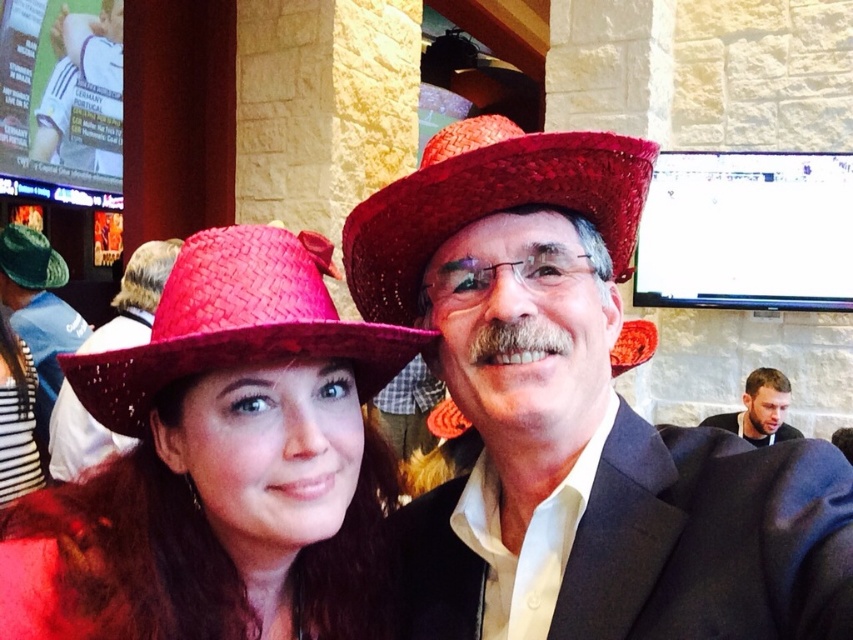
From the picture: Can you confirm if bright red woven cowboy hat at center is smaller than green felt hat at upper left?

Yes, bright red woven cowboy hat at center is smaller than green felt hat at upper left.

Does bright red woven cowboy hat at center appear over green felt hat at upper left?

Incorrect, bright red woven cowboy hat at center is not positioned above green felt hat at upper left.

Does point (373, 394) come behind point (10, 236)?

No, (373, 394) is closer to viewer.

Where is `bright red woven cowboy hat at center`? bright red woven cowboy hat at center is located at coordinates (238, 323).

Who is shorter, matte pink straw hat at center or red woven cowboy hat at center?

With less height is red woven cowboy hat at center.

How distant is matte pink straw hat at center from red woven cowboy hat at center?

matte pink straw hat at center is 9.21 inches from red woven cowboy hat at center.

Who is more distant from viewer, (210,406) or (403,230)?

The point (403,230) is behind.

This screenshot has width=853, height=640. What are the coordinates of `matte pink straw hat at center` in the screenshot? It's located at (218, 464).

Which is more to the right, matte red straw hat at center or red woven cowboy hat at center?

matte red straw hat at center is more to the right.

Who is more forward, [602,438] or [570,205]?

Point [570,205]

Identify the location of matte red straw hat at center. (577, 419).